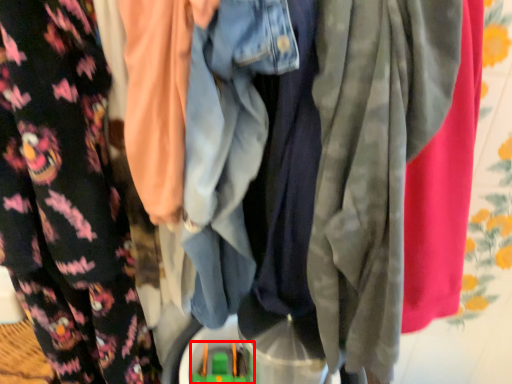
Question: From the image's perspective, what is the correct spatial positioning of toy (annotated by the red box) in reference to fancy dress?

Choices:
 (A) above
 (B) below

Answer: (B)